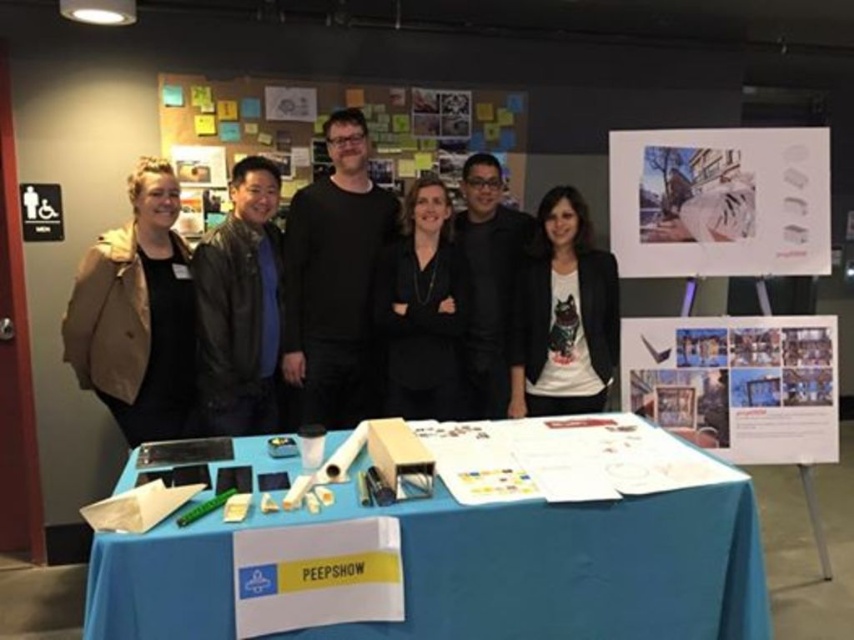
Is white matte shirt at center below black matte jacket at center?

Yes.

I want to click on white matte shirt at center, so click(x=564, y=316).

What do you see at coordinates (360, 116) in the screenshot?
I see `multicolored paper notes at center` at bounding box center [360, 116].

Is point (275, 156) farther from viewer compared to point (405, 342)?

Yes, point (275, 156) is farther from viewer.

Describe the element at coordinates (360, 116) in the screenshot. I see `multicolored paper notes at center` at that location.

At what (x,y) coordinates should I click in order to perform the action: click on multicolored paper notes at center. Please return your answer as a coordinate pair (x, y). This screenshot has height=640, width=854. Looking at the image, I should click on (360, 116).

This screenshot has height=640, width=854. Describe the element at coordinates (137, 316) in the screenshot. I see `matte beige jacket at left` at that location.

Is point (95, 305) farther from camera compared to point (512, 296)?

No, it is not.

The height and width of the screenshot is (640, 854). Identify the location of matte beige jacket at left. (137, 316).